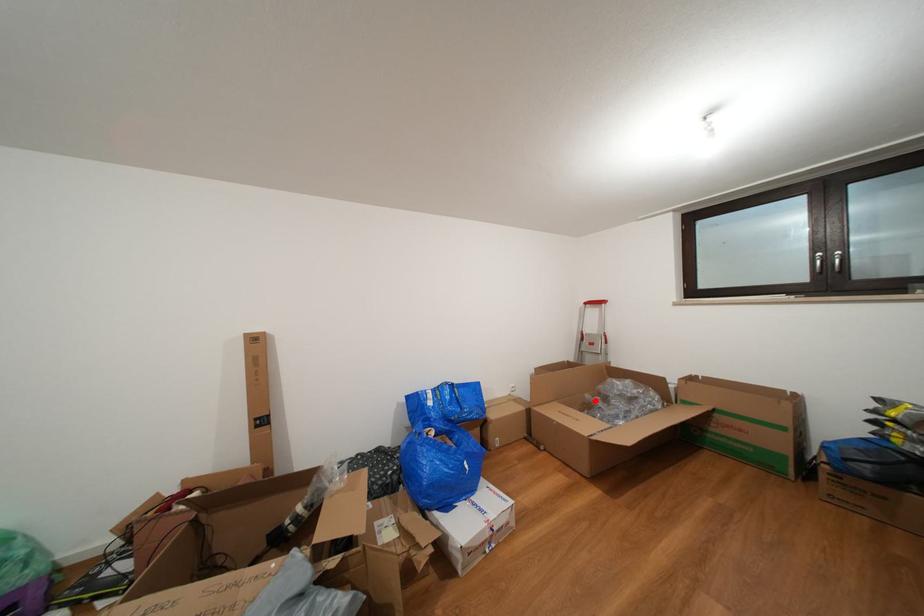
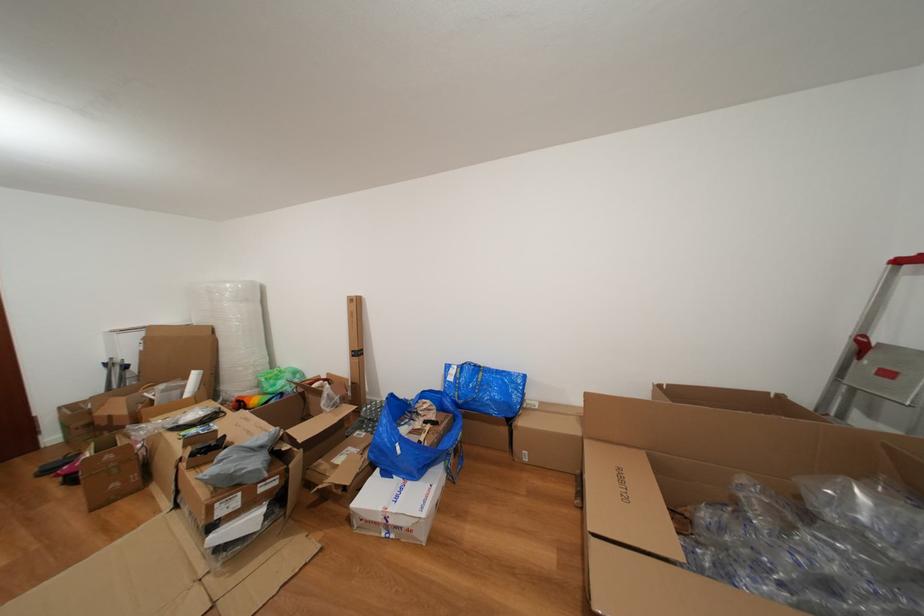
Question: A red point is marked in image1. In image2, is the corresponding 3D point closer to the camera or farther? Reply with the corresponding letter.

Choices:
 (A) The corresponding 3D point is closer.
 (B) The corresponding 3D point is farther.

Answer: (A)